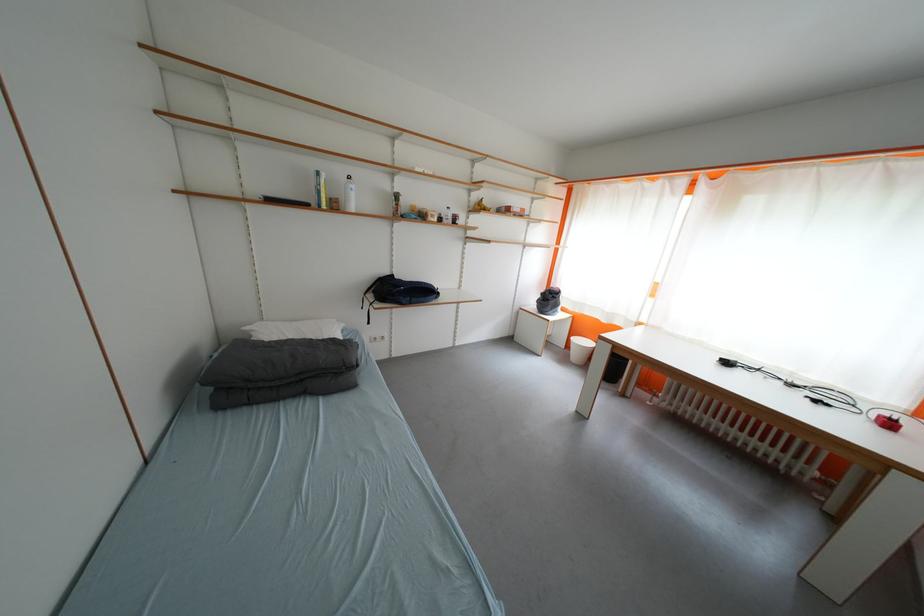
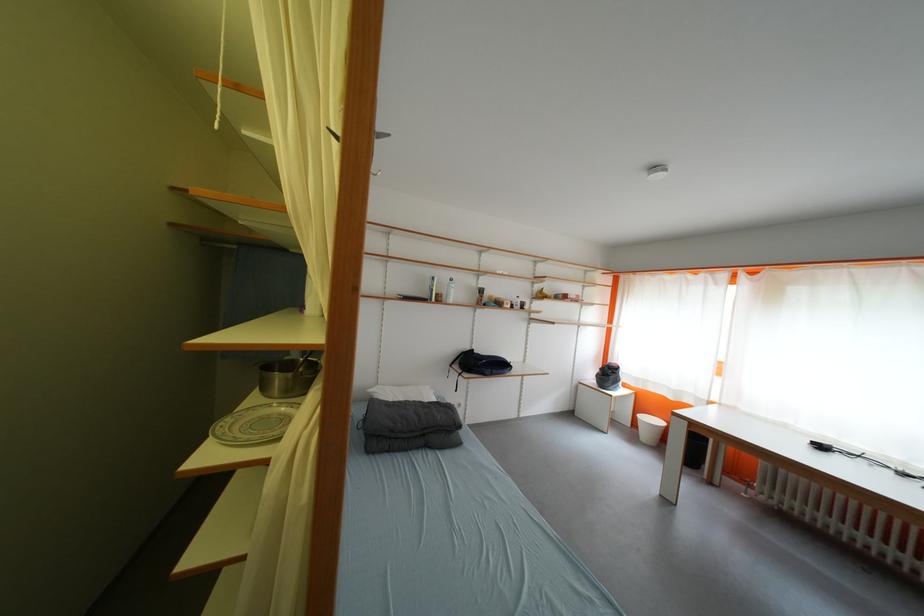
Locate, in the second image, the point that corresponds to (379,299) in the first image.

(466, 370)